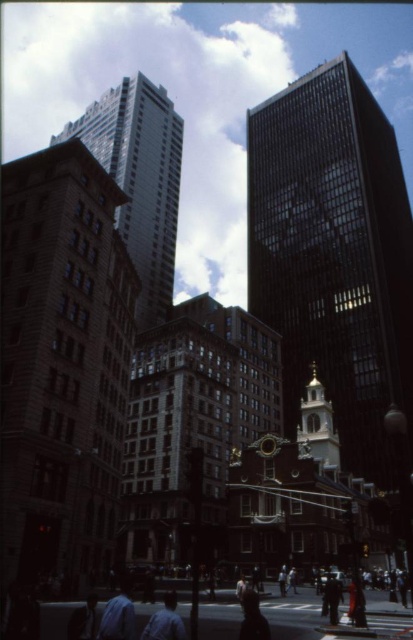
Can you confirm if glassy reflective skyscraper at upper left is wider than dark blue shirt at lower center?

Correct, the width of glassy reflective skyscraper at upper left exceeds that of dark blue shirt at lower center.

Based on the photo, which is below, glassy reflective skyscraper at upper left or dark blue shirt at lower center?

dark blue shirt at lower center is below.

I want to click on glassy reflective skyscraper at upper left, so coord(140,179).

The image size is (413, 640). In order to click on glassy reflective skyscraper at upper left in this screenshot , I will do `click(140, 179)`.

Does point (139, 308) lie in front of point (398, 604)?

No, it is not.

Is point (135, 164) closer to camera compared to point (130, 614)?

That is False.

Where is `glassy reflective skyscraper at upper left`? glassy reflective skyscraper at upper left is located at coordinates (140, 179).

Is point (336, 444) less distant than point (251, 600)?

No, (336, 444) is further to viewer.

Who is shorter, goldmaterial/texturetower at center or dark blue shirt at lower center?

With less height is dark blue shirt at lower center.

The height and width of the screenshot is (640, 413). Describe the element at coordinates (318, 426) in the screenshot. I see `goldmaterial/texturetower at center` at that location.

Locate an element on the screen. The width and height of the screenshot is (413, 640). goldmaterial/texturetower at center is located at coordinates (318, 426).